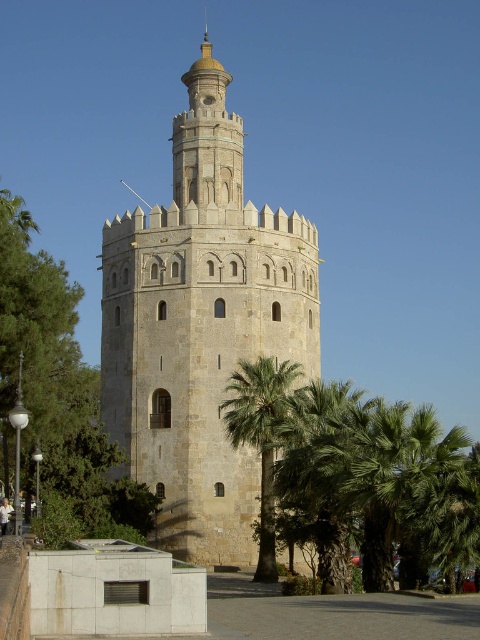
Question: Which object appears closest to the camera in this image?

Choices:
 (A) green leafy palm at center
 (B) green leafy tree at left
 (C) beige stone tower at center

Answer: (B)

Question: Does beige stone tower at center have a smaller size compared to green leafy tree at left?

Choices:
 (A) yes
 (B) no

Answer: (A)

Question: Which of the following is the farthest from the observer?

Choices:
 (A) (468, 531)
 (B) (266, 244)
 (C) (260, 500)
 (D) (27, 435)

Answer: (B)

Question: Does green leafy palm at center appear on the right side of green leafy tree at left?

Choices:
 (A) yes
 (B) no

Answer: (A)

Question: Based on their relative distances, which object is farther from the beige stone tower at center?

Choices:
 (A) green leafy palm tree at center
 (B) green leafy palm at center
 (C) green leafy tree at left

Answer: (C)

Question: Is green leafy tree at left thinner than green leafy palm tree at center?

Choices:
 (A) no
 (B) yes

Answer: (A)